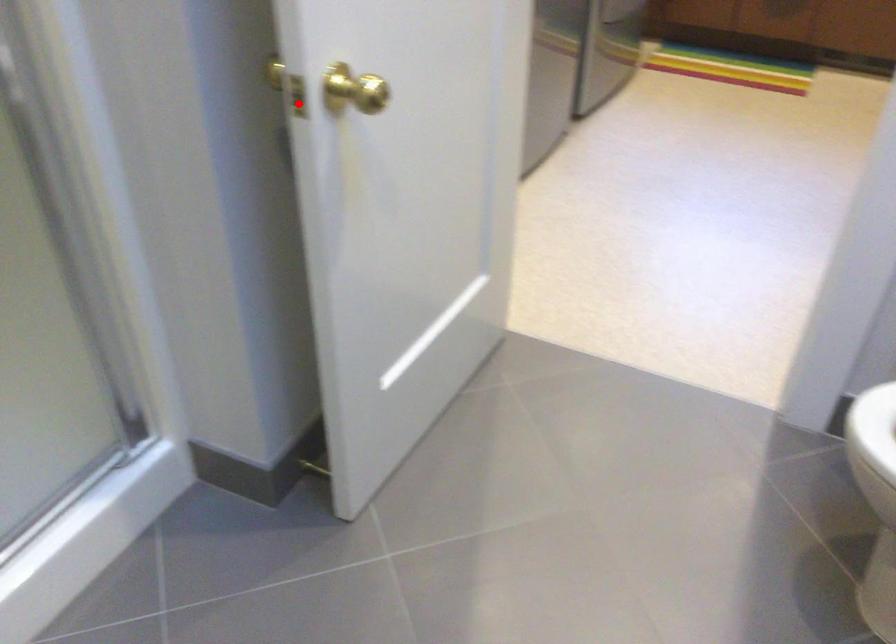
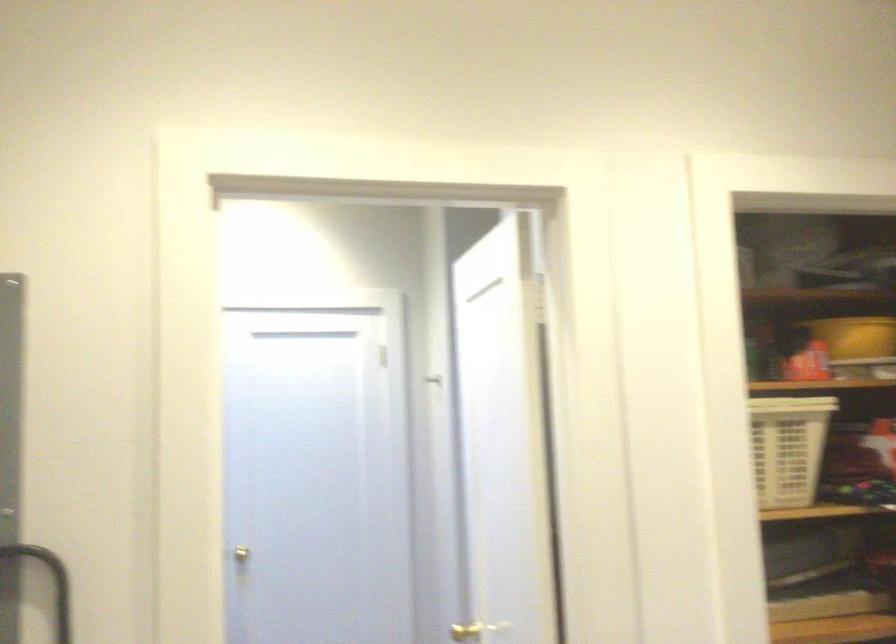
Locate, in the second image, the point that corresponds to the highlighted location in the first image.

(464, 632)